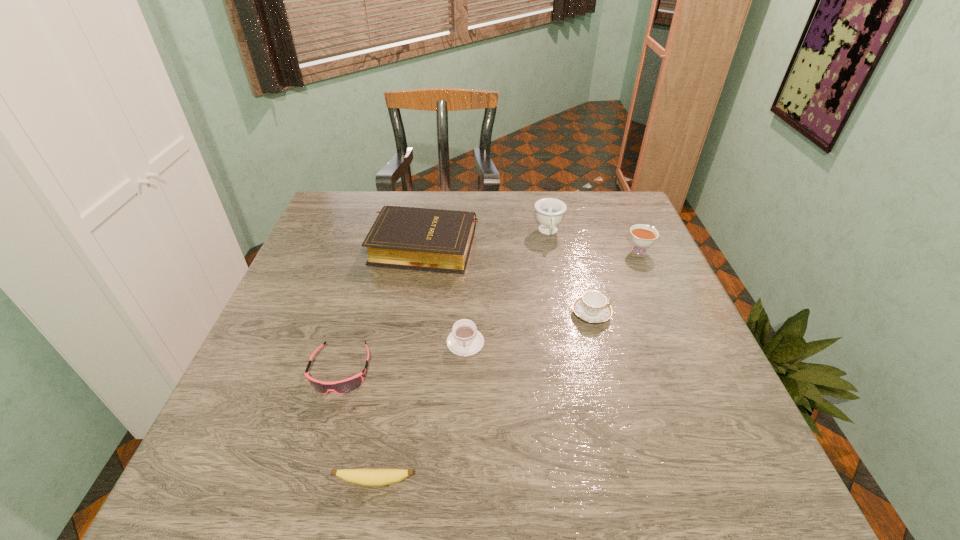
Find the location of a particular element. vacant space positioned on the side of the third shortest teacup with the handle is located at coordinates (618, 202).

At what (x,y) coordinates should I click in order to perform the action: click on vacant space located 0.250m on the side of the third shortest teacup with the handle. Please return your answer as a coordinate pair (x, y). This screenshot has width=960, height=540. Looking at the image, I should click on (614, 194).

The width and height of the screenshot is (960, 540). I want to click on vacant space situated on the side of the third shortest teacup with the handle, so tap(622, 211).

The height and width of the screenshot is (540, 960). Find the location of `vacant space located 0.130m on the side with the handle of the fourth nearest object`. vacant space located 0.130m on the side with the handle of the fourth nearest object is located at coordinates (667, 314).

Identify the location of free space located 0.050m on the front-facing side of the goggles. (325, 421).

Find the location of a particular element. This screenshot has height=540, width=960. free region located 0.120m on the handle side of the nearest teacup is located at coordinates (464, 407).

The width and height of the screenshot is (960, 540). I want to click on free region located on the right of the banana, so click(518, 482).

The height and width of the screenshot is (540, 960). In order to click on teacup at the far edge in this screenshot , I will do `click(550, 211)`.

Image resolution: width=960 pixels, height=540 pixels. What are the coordinates of `Bible located at the far edge` in the screenshot? It's located at (438, 240).

You are a GUI agent. You are given a task and a screenshot of the screen. Output one action in this format:
    pyautogui.click(x=<x>, y=<y>)
    Task: Click on the object that is at the near edge
    The height and width of the screenshot is (540, 960).
    Given the screenshot: What is the action you would take?
    pyautogui.click(x=365, y=477)